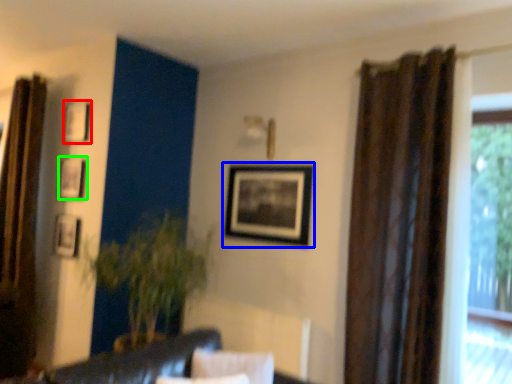
Question: Estimate the real-world distances between objects in this image. Which object is farther from picture frame (highlighted by a red box), picture frame (highlighted by a blue box) or picture frame (highlighted by a green box)?

Choices:
 (A) picture frame
 (B) picture frame

Answer: (A)